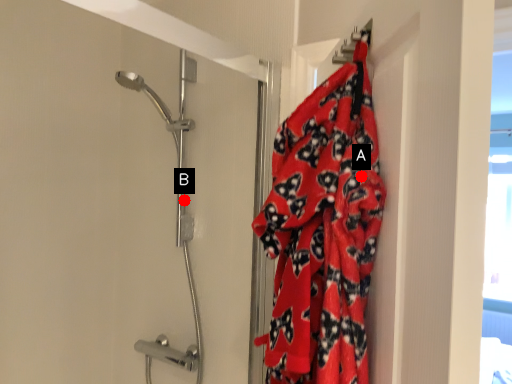
Question: Two points are circled on the image, labeled by A and B beside each circle. Among these points, which one is nearest to the camera?

Choices:
 (A) A is closer
 (B) B is closer

Answer: (A)